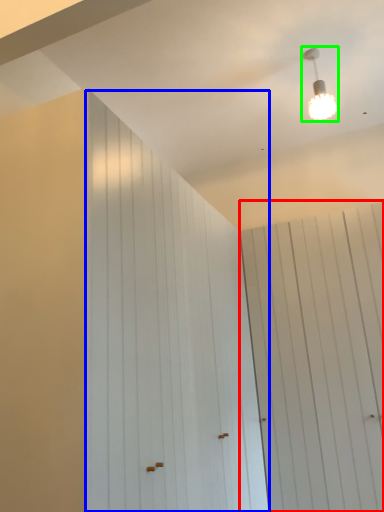
Question: Which object is positioned farthest from barn door (highlighted by a red box)? Select from barn door (highlighted by a blue box) and lamp (highlighted by a green box).

Choices:
 (A) barn door
 (B) lamp

Answer: (B)